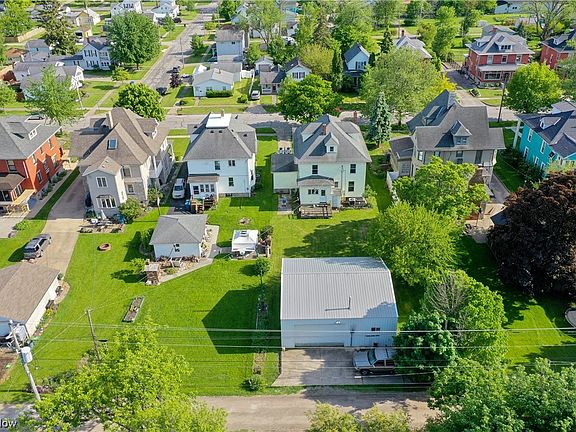
The width and height of the screenshot is (576, 432). In order to click on chimney in this screenshot , I will do `click(324, 129)`, `click(222, 110)`, `click(107, 125)`, `click(403, 34)`, `click(219, 72)`, `click(88, 40)`, `click(21, 60)`.